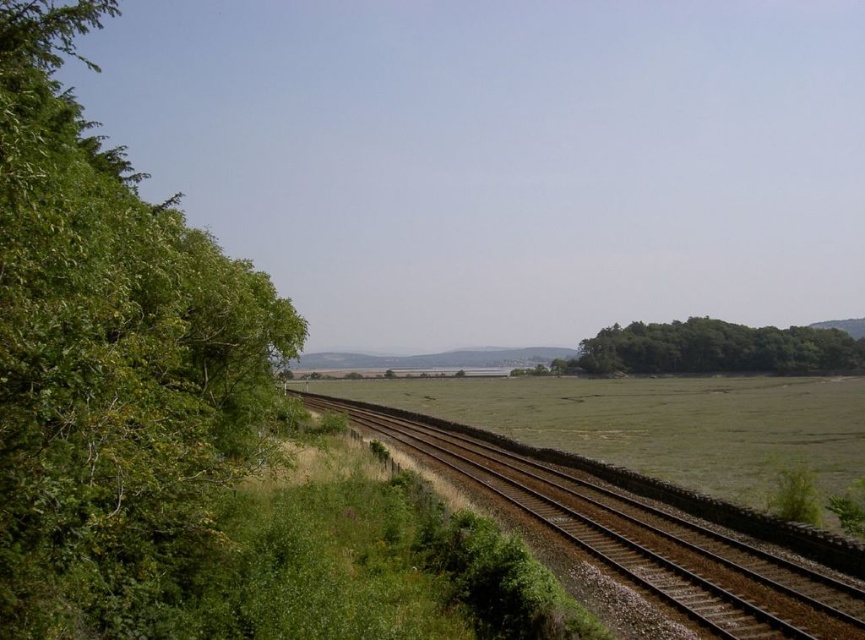
Question: Among these objects, which one is farthest from the camera?

Choices:
 (A) green leafy trees at right
 (B) brown gravel track at center
 (C) green leafy tree at left

Answer: (A)

Question: Is green leafy tree at left closer to camera compared to brown gravel track at center?

Choices:
 (A) no
 (B) yes

Answer: (B)

Question: Can you confirm if brown gravel track at center is thinner than green leafy trees at right?

Choices:
 (A) yes
 (B) no

Answer: (A)

Question: Estimate the real-world distances between objects in this image. Which object is closer to the brown gravel track at center?

Choices:
 (A) green leafy trees at right
 (B) green leafy tree at left

Answer: (B)

Question: In this image, where is green leafy tree at left located relative to green leafy trees at right?

Choices:
 (A) below
 (B) above

Answer: (B)

Question: Which of the following is the closest to the observer?

Choices:
 (A) [x=216, y=257]
 (B) [x=751, y=349]
 (C) [x=569, y=528]

Answer: (A)